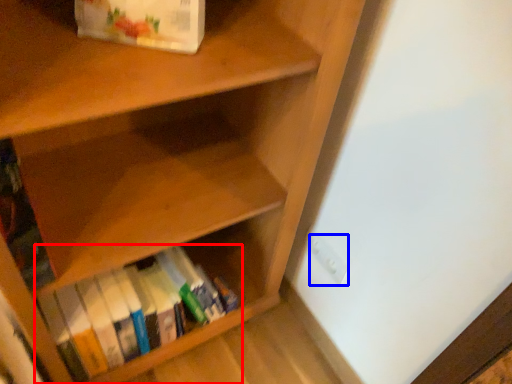
Question: Which of the following is the closest to the observer, book (highlighted by a red box) or electric outlet (highlighted by a blue box)?

Choices:
 (A) book
 (B) electric outlet

Answer: (A)